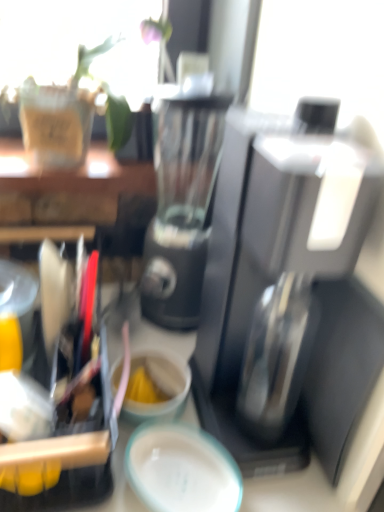
Question: Would you say teal glossy plate at center is a long distance from matte ceramic coffee cup at center?

Choices:
 (A) no
 (B) yes

Answer: (A)

Question: Can you confirm if teal glossy plate at center is shorter than matte ceramic coffee cup at center?

Choices:
 (A) yes
 (B) no

Answer: (A)

Question: Does teal glossy plate at center appear on the left side of matte ceramic coffee cup at center?

Choices:
 (A) no
 (B) yes

Answer: (A)

Question: Considering the relative sizes of teal glossy plate at center and matte ceramic coffee cup at center in the image provided, is teal glossy plate at center bigger than matte ceramic coffee cup at center?

Choices:
 (A) no
 (B) yes

Answer: (A)

Question: Could you tell me if teal glossy plate at center is turned towards matte ceramic coffee cup at center?

Choices:
 (A) yes
 (B) no

Answer: (B)

Question: Is matte ceramic coffee cup at center at the back of teal glossy plate at center?

Choices:
 (A) no
 (B) yes

Answer: (A)

Question: Considering the relative positions of sleek black coffee maker at center and matte ceramic coffee cup at center in the image provided, is sleek black coffee maker at center to the right of matte ceramic coffee cup at center from the viewer's perspective?

Choices:
 (A) no
 (B) yes

Answer: (B)

Question: Is sleek black coffee maker at center positioned beyond the bounds of matte ceramic coffee cup at center?

Choices:
 (A) no
 (B) yes

Answer: (B)

Question: Is the position of sleek black coffee maker at center more distant than that of matte ceramic coffee cup at center?

Choices:
 (A) no
 (B) yes

Answer: (A)

Question: From a real-world perspective, is sleek black coffee maker at center positioned under matte ceramic coffee cup at center based on gravity?

Choices:
 (A) yes
 (B) no

Answer: (B)

Question: From the image's perspective, is sleek black coffee maker at center below matte ceramic coffee cup at center?

Choices:
 (A) no
 (B) yes

Answer: (A)

Question: Does sleek black coffee maker at center turn towards matte ceramic coffee cup at center?

Choices:
 (A) no
 (B) yes

Answer: (A)

Question: Considering the relative sizes of teal glossy plate at center and sleek black coffee maker at center in the image provided, is teal glossy plate at center thinner than sleek black coffee maker at center?

Choices:
 (A) yes
 (B) no

Answer: (A)